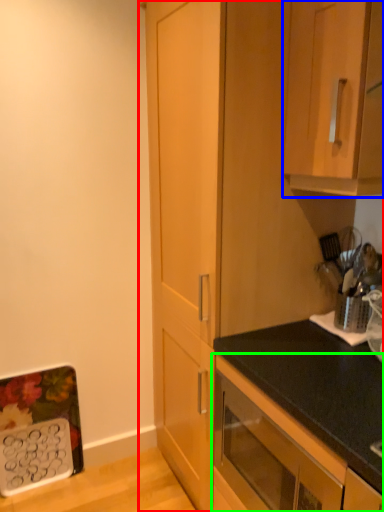
Question: Estimate the real-world distances between objects in this image. Which object is closer to cabinetry (highlighted by a red box), cabinetry (highlighted by a blue box) or cabinetry (highlighted by a green box)?

Choices:
 (A) cabinetry
 (B) cabinetry

Answer: (A)